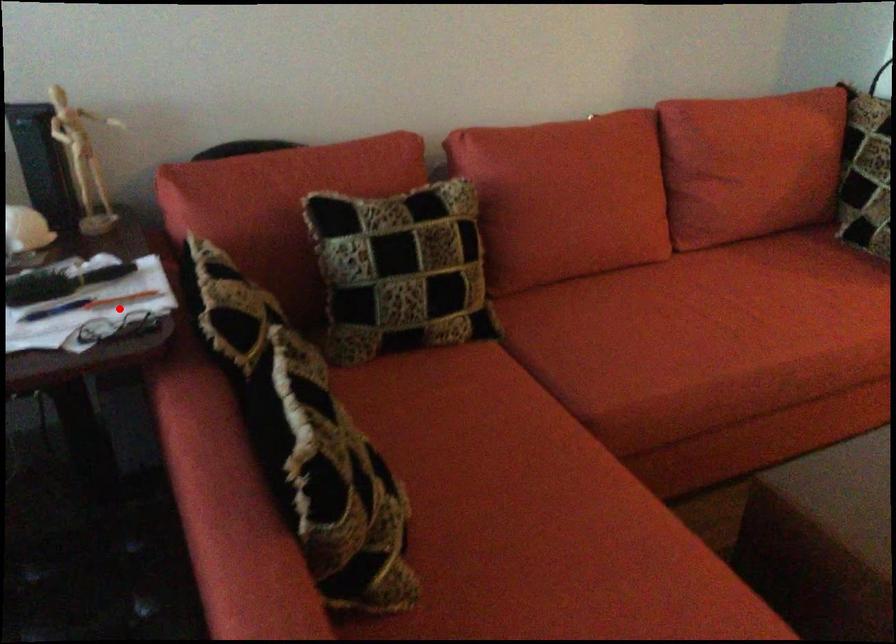
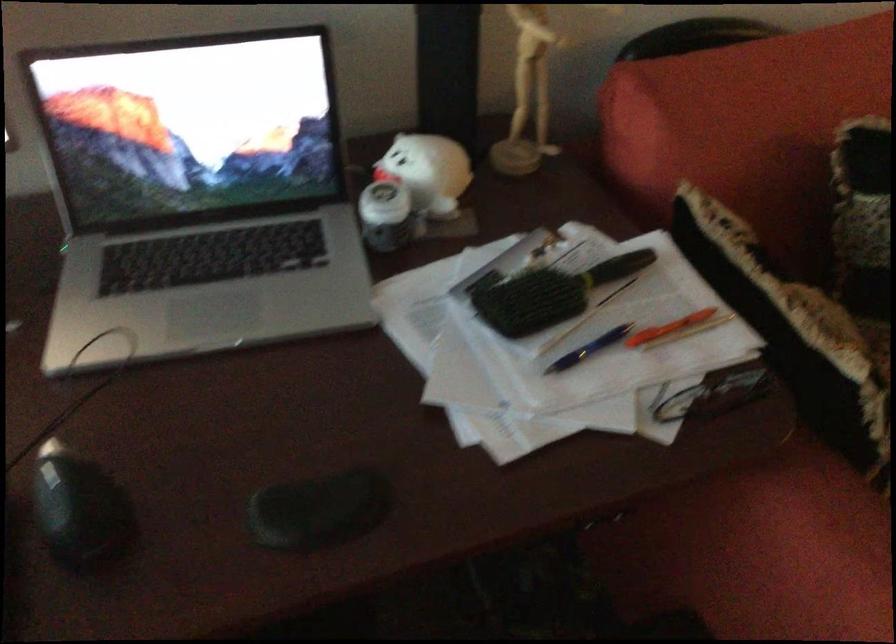
Locate, in the second image, the point that corresponds to the highlighted location in the first image.

(668, 328)